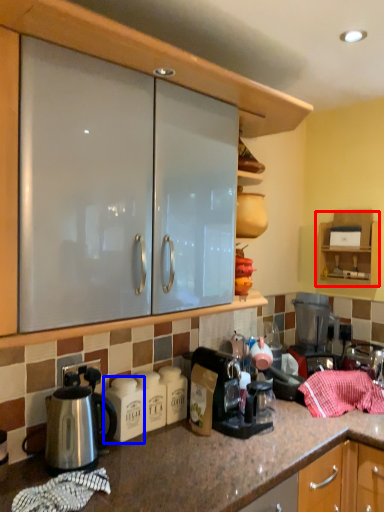
Question: Which object is further to the camera taking this photo, cabinetry (highlighted by a red box) or appliance (highlighted by a blue box)?

Choices:
 (A) cabinetry
 (B) appliance

Answer: (A)